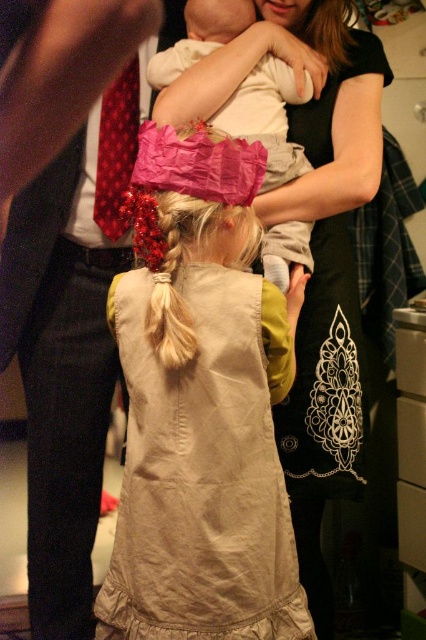
Is light beige fabric dress at center closer to the viewer compared to soft white fabric baby at center?

Yes, it is in front of soft white fabric baby at center.

Which is behind, point (215, 365) or point (255, 100)?

The point (255, 100) is behind.

This screenshot has width=426, height=640. Identify the location of light beige fabric dress at center. (201, 406).

What are the coordinates of `light beige fabric dress at center` in the screenshot? It's located at (201, 406).

Who is positioned more to the left, light beige fabric dress at center or black cotton dress at center?

light beige fabric dress at center

Looking at this image, does light beige fabric dress at center have a greater height compared to black cotton dress at center?

No, light beige fabric dress at center is not taller than black cotton dress at center.

Image resolution: width=426 pixels, height=640 pixels. Describe the element at coordinates (201, 406) in the screenshot. I see `light beige fabric dress at center` at that location.

Find the location of a particular element. The width and height of the screenshot is (426, 640). light beige fabric dress at center is located at coordinates (201, 406).

Who is more distant from viewer, (337, 380) or (302, 264)?

Positioned behind is point (337, 380).

Who is taller, black cotton dress at center or soft white fabric baby at center?

black cotton dress at center

Which is behind, point (302, 378) or point (224, 131)?

The point (302, 378) is behind.

Where is `black cotton dress at center`? The width and height of the screenshot is (426, 640). black cotton dress at center is located at coordinates (313, 244).